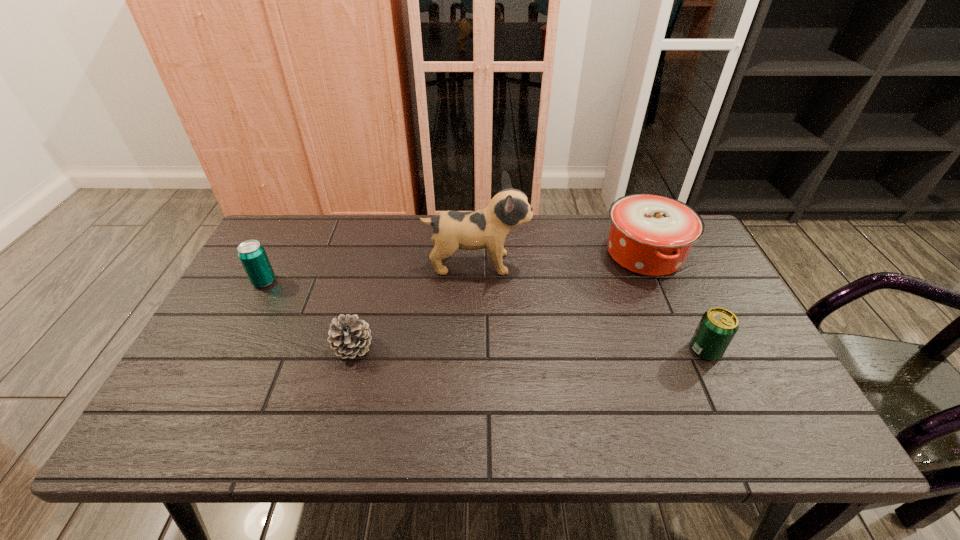
In the image, there is a desktop. At what (x,y) coordinates should I click in order to perform the action: click on vacant space at the right edge. Please return your answer as a coordinate pair (x, y). Looking at the image, I should click on (699, 357).

Where is `vacant space at the near right corner`? vacant space at the near right corner is located at coordinates (756, 414).

Locate an element on the screen. The image size is (960, 540). unoccupied area between the pinecone and the tallest object is located at coordinates (415, 306).

Image resolution: width=960 pixels, height=540 pixels. What are the coordinates of `vacant area between the nearer beer can and the puppy` in the screenshot? It's located at click(591, 307).

The height and width of the screenshot is (540, 960). Identify the location of vacant space that is in between the right beer can and the tallest object. (591, 307).

The image size is (960, 540). I want to click on free area in between the casserole and the nearer beer can, so click(x=675, y=302).

Where is `vacant space that's between the puppy and the leftmost object`? The image size is (960, 540). vacant space that's between the puppy and the leftmost object is located at coordinates (371, 273).

Locate an element on the screen. free spot between the third object from right to left and the leftmost object is located at coordinates (371, 273).

Where is `unoccupied area between the fourth object from right to left and the left beer can`? This screenshot has width=960, height=540. unoccupied area between the fourth object from right to left and the left beer can is located at coordinates (308, 314).

Where is `free area in between the right beer can and the second tallest object`? free area in between the right beer can and the second tallest object is located at coordinates (675, 302).